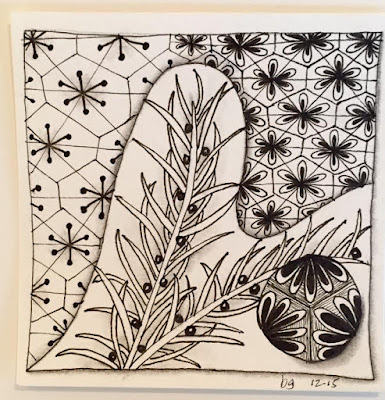
At what (x,y) coordinates should I click in order to perform the action: click on floral pattern. Please return your answer as a coordinate pair (x, y). Looking at the image, I should click on (304, 116).